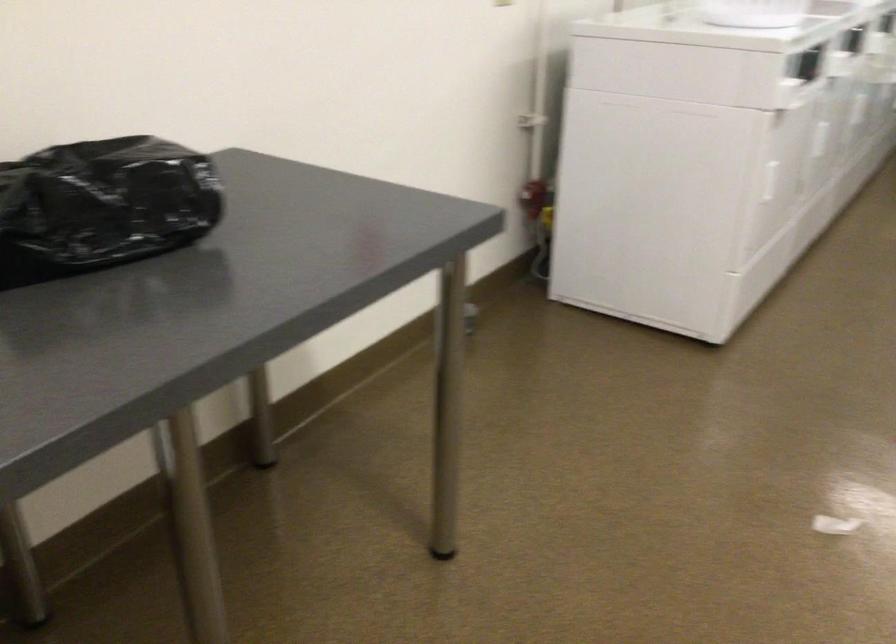
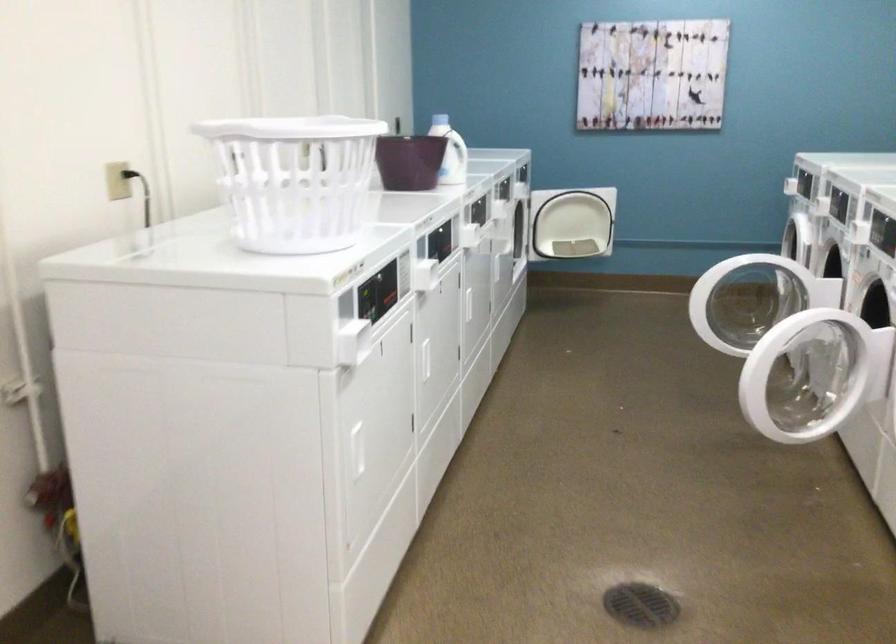
Question: How did the camera likely rotate?

Choices:
 (A) Left
 (B) Right
 (C) Up
 (D) Down

Answer: (B)